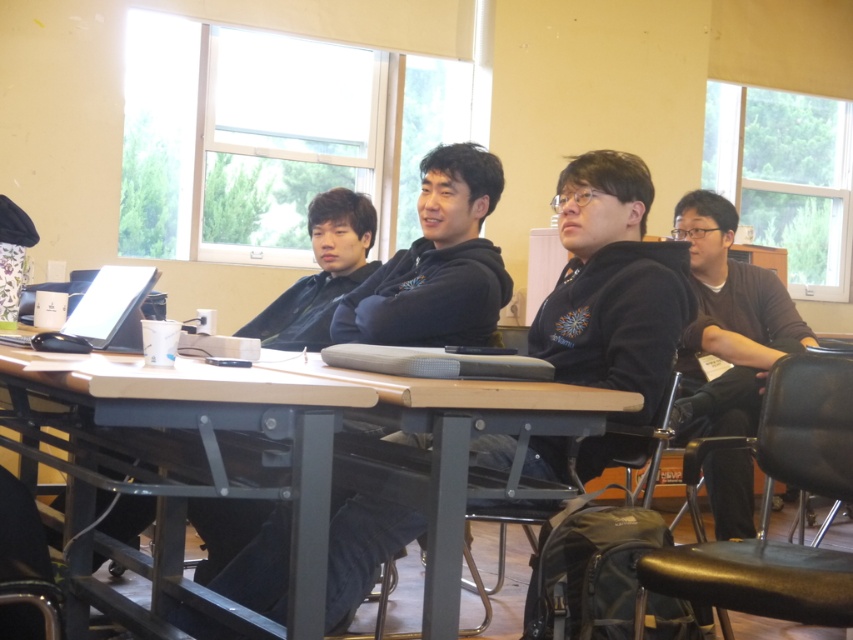
You are organizing a small workshop and need to ensure there is enough space for participants to work comfortably. Given the wooden table at center and the black fleece hoodie at center, which object has a greater width?

The wooden table at center has a greater width than the black fleece hoodie at center.

You are organizing a photo shoot and need to place a large prop on the table between the black fleece hoodie at center and the matte black laptop at left. Given their sizes, which object should the prop be placed closer to?

The prop should be placed closer to the black fleece hoodie at center because it is larger than the matte black laptop at left, providing more space for the prop to be positioned near it.

Consider the image. You are sitting at the table and want to grab the matte black laptop at left to take a closer look. However, the black fleece hoodie at center is in your way. Can you reach the laptop without moving the hoodie?

The black fleece hoodie at center is further to the viewer than the matte black laptop at left, meaning the hoodie is closer to you. Since the hoodie is closer, you can reach around it to access the laptop behind it, so yes, you can reach the matte black laptop at left without moving the hoodie.